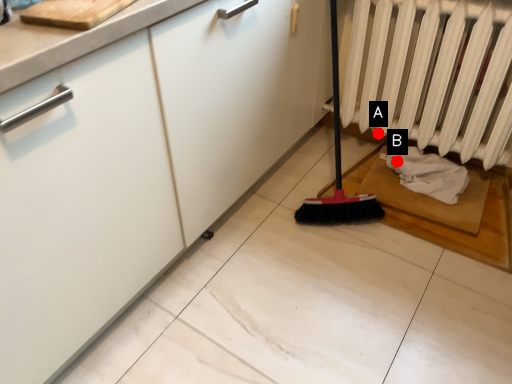
Question: Two points are circled on the image, labeled by A and B beside each circle. Which point is farther from the camera taking this photo?

Choices:
 (A) A is further
 (B) B is further

Answer: (A)